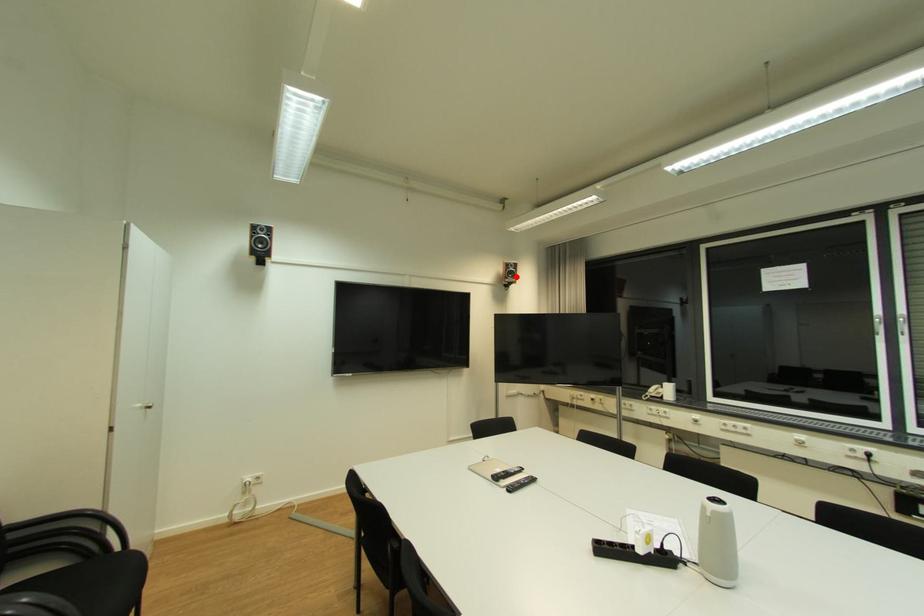
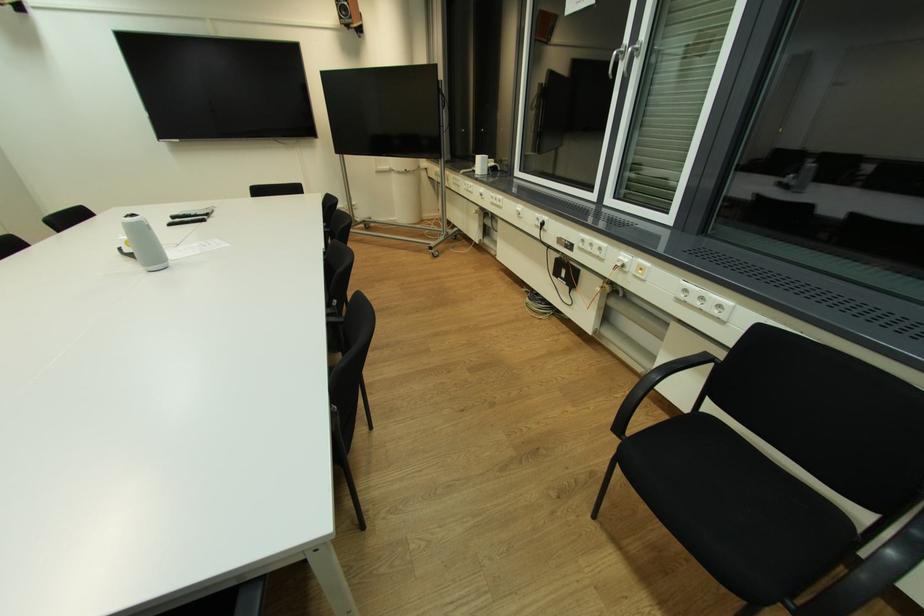
In the second image, find the point that corresponds to the highlighted location in the first image.

(349, 15)